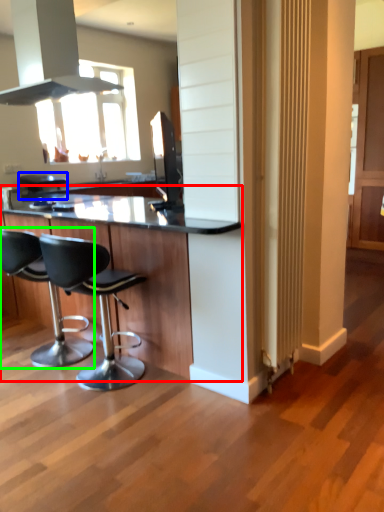
Question: Considering the real-world distances, which object is closest to table (highlighted by a red box)? bar stool (highlighted by a blue box) or chair (highlighted by a green box).

Choices:
 (A) bar stool
 (B) chair

Answer: (B)